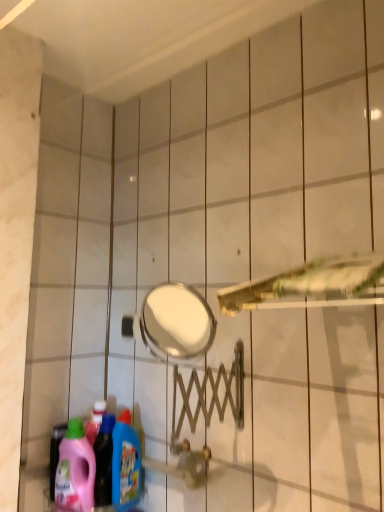
Question: Can you confirm if blue glossy detergent at lower left, the second cleaning product viewed from the left, is shorter than pink plastic detergent at lower left, which is the 2th cleaning product from right to left?

Choices:
 (A) yes
 (B) no

Answer: (B)

Question: From a real-world perspective, is blue glossy detergent at lower left, the second cleaning product viewed from the left, located beneath pink plastic detergent at lower left, which is the 2th cleaning product from right to left?

Choices:
 (A) no
 (B) yes

Answer: (A)

Question: Does blue glossy detergent at lower left, arranged as the first cleaning product when viewed from the right, turn towards pink plastic detergent at lower left, the first cleaning product in the left-to-right sequence?

Choices:
 (A) yes
 (B) no

Answer: (B)

Question: Is blue glossy detergent at lower left, the second cleaning product viewed from the left, oriented away from pink plastic detergent at lower left, which is the 2th cleaning product from right to left?

Choices:
 (A) yes
 (B) no

Answer: (B)

Question: Does blue glossy detergent at lower left, arranged as the first cleaning product when viewed from the right, have a lesser width compared to pink plastic detergent at lower left, the first cleaning product in the left-to-right sequence?

Choices:
 (A) no
 (B) yes

Answer: (B)

Question: In the image, is blue glossy detergent at lower left, the second cleaning product viewed from the left, on the left side or the right side of metallic gold shower head at center?

Choices:
 (A) right
 (B) left

Answer: (B)

Question: Is blue glossy detergent at lower left, arranged as the first cleaning product when viewed from the right, bigger or smaller than metallic gold shower head at center?

Choices:
 (A) small
 (B) big

Answer: (A)

Question: Is blue glossy detergent at lower left, arranged as the first cleaning product when viewed from the right, in front of or behind metallic gold shower head at center in the image?

Choices:
 (A) behind
 (B) front

Answer: (A)

Question: Considering the positions of blue glossy detergent at lower left, the second cleaning product viewed from the left, and metallic gold shower head at center in the image, is blue glossy detergent at lower left, the second cleaning product viewed from the left, taller or shorter than metallic gold shower head at center?

Choices:
 (A) short
 (B) tall

Answer: (B)

Question: Is blue glossy detergent at lower left, the second cleaning product viewed from the left, wider or thinner than pink plastic detergent at lower left, which is the 2th cleaning product from right to left?

Choices:
 (A) thin
 (B) wide

Answer: (A)

Question: Would you say blue glossy detergent at lower left, arranged as the first cleaning product when viewed from the right, is to the left or to the right of pink plastic detergent at lower left, which is the 2th cleaning product from right to left, in the picture?

Choices:
 (A) right
 (B) left

Answer: (A)

Question: Considering their positions, is blue glossy detergent at lower left, arranged as the first cleaning product when viewed from the right, located in front of or behind pink plastic detergent at lower left, which is the 2th cleaning product from right to left?

Choices:
 (A) front
 (B) behind

Answer: (B)

Question: Choose the correct answer: Is blue glossy detergent at lower left, arranged as the first cleaning product when viewed from the right, inside pink plastic detergent at lower left, the first cleaning product in the left-to-right sequence, or outside it?

Choices:
 (A) outside
 (B) inside

Answer: (A)

Question: Considering the positions of point (87, 446) and point (124, 415), is point (87, 446) closer or farther from the camera than point (124, 415)?

Choices:
 (A) closer
 (B) farther

Answer: (A)

Question: Is pink plastic detergent at lower left, which is the 2th cleaning product from right to left, inside the boundaries of blue glossy detergent at lower left, arranged as the first cleaning product when viewed from the right, or outside?

Choices:
 (A) inside
 (B) outside

Answer: (B)